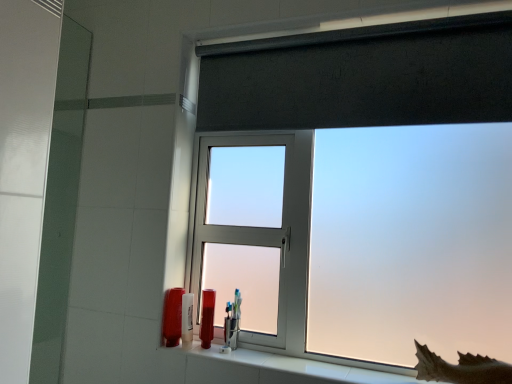
The height and width of the screenshot is (384, 512). In order to click on space that is in front of clear plastic toothbrush holder at center, the 1th toiletry viewed from the right in this screenshot , I will do `click(239, 356)`.